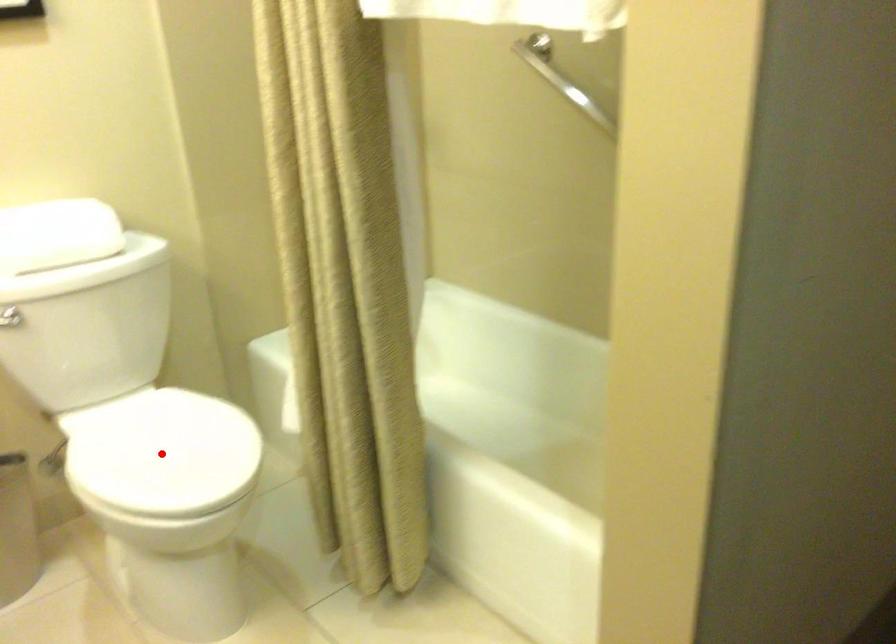
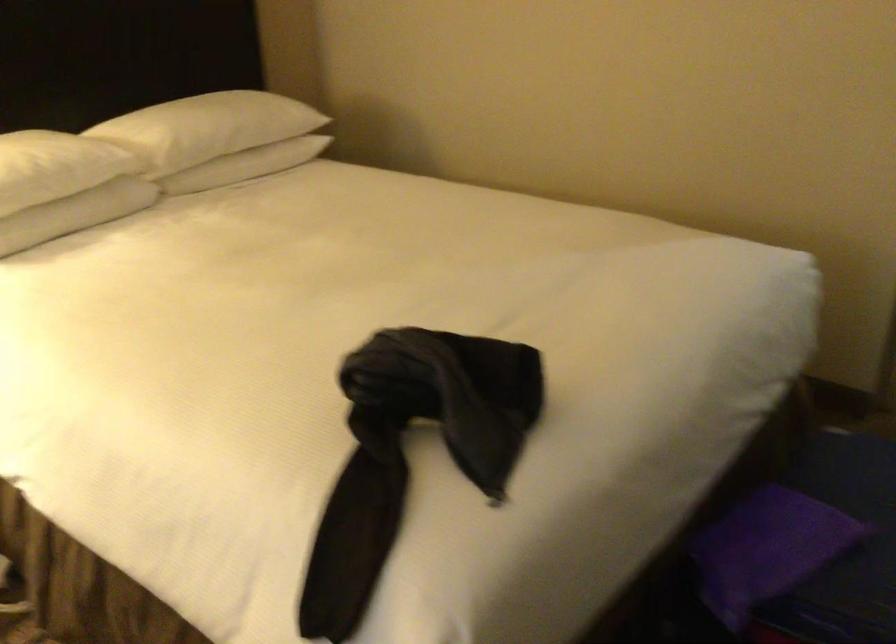
Question: I am providing you with two images of the same scene from different viewpoints. A red point is marked on the first image. Is the red point's position out of view in image 2?

Choices:
 (A) Yes
 (B) No

Answer: (A)